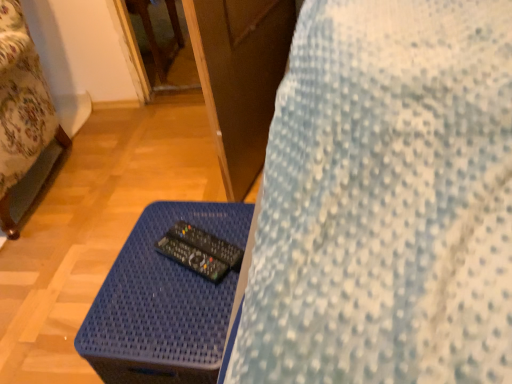
I want to click on free space that is to the left of black plastic remote at center, acting as the 2th control starting from the bottom, so click(136, 271).